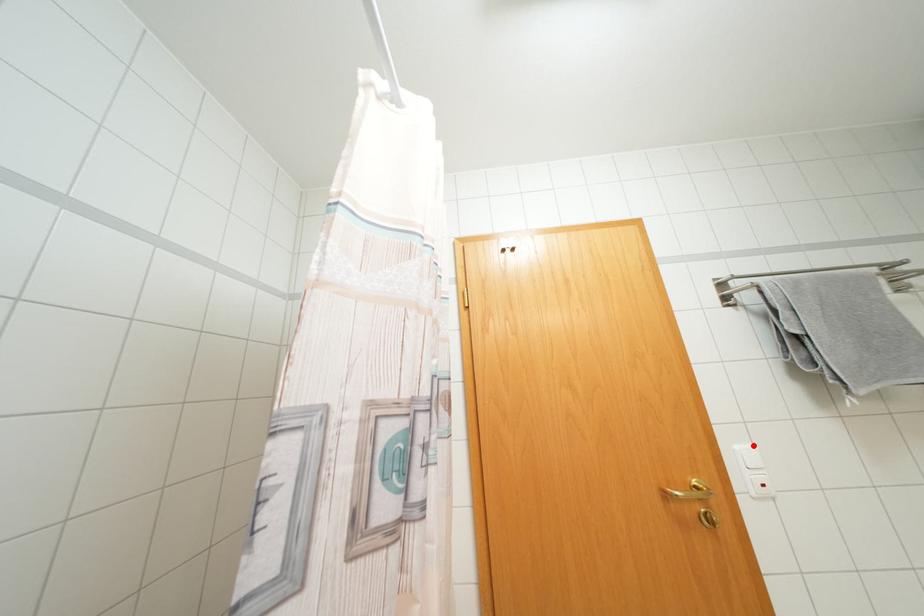
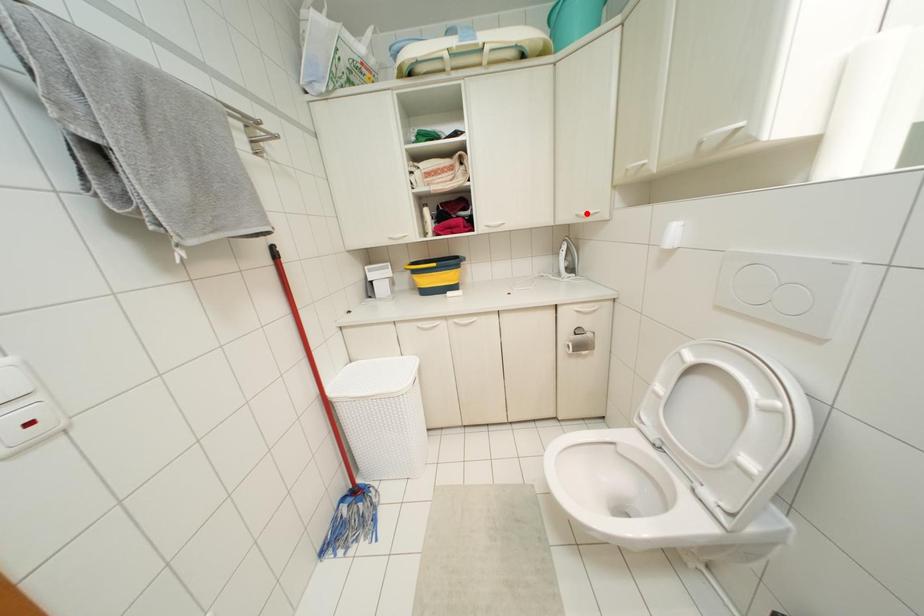
I am providing you with two images of the same scene from different viewpoints. A red point is marked on the first image and another point is marked on the second image. Are the points marked in image1 and image2 representing the same 3D position?

No